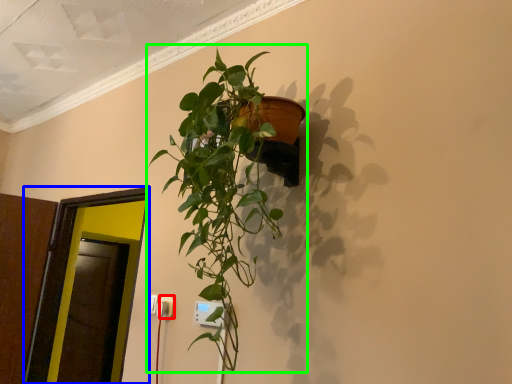
Question: Which object is positioned closest to electric outlet (highlighted by a red box)? Select from glass door (highlighted by a blue box) and houseplant (highlighted by a green box).

Choices:
 (A) glass door
 (B) houseplant

Answer: (B)